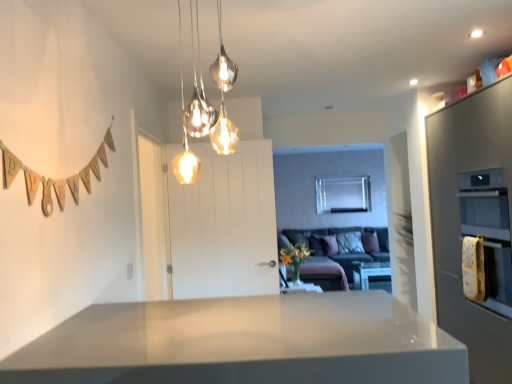
Question: Does point (496, 360) appear closer or farther from the camera than point (211, 205)?

Choices:
 (A) closer
 (B) farther

Answer: (A)

Question: Is satin grey oven at right inside or outside of white wooden door at center?

Choices:
 (A) outside
 (B) inside

Answer: (A)

Question: Estimate the real-world distances between objects in this image. Which object is farther from the satin grey oven at right?

Choices:
 (A) metallic glass pendant lights at upper center
 (B) white glossy table at center
 (C) gold textured oven at right
 (D) velvet grey couch at center
 (E) white wooden door at center

Answer: (D)

Question: Which object is the farthest from the white glossy countertop at center?

Choices:
 (A) metallic glass pendant lights at upper center
 (B) velvet grey couch at center
 (C) white glossy table at center
 (D) white wooden door at center
 (E) gold textured oven at right

Answer: (C)